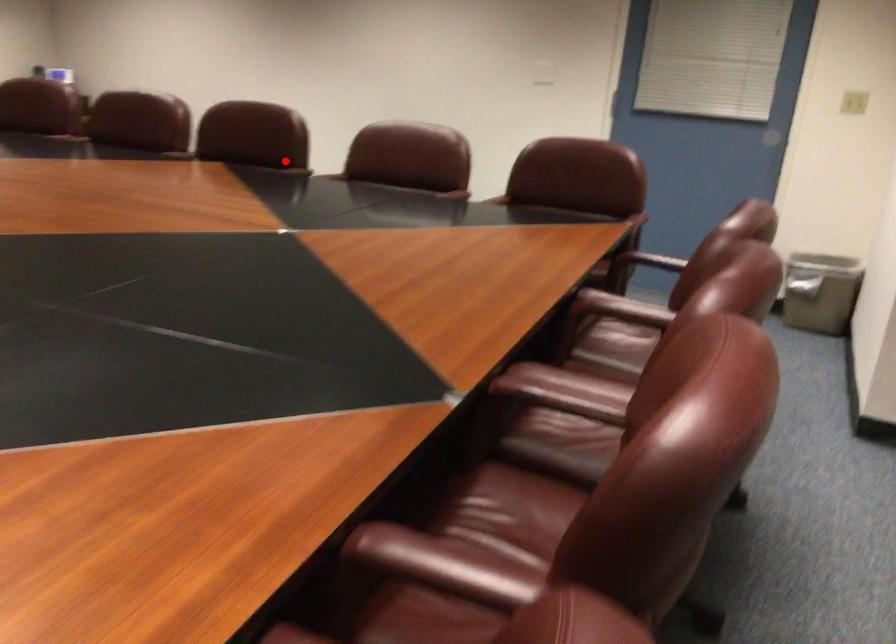
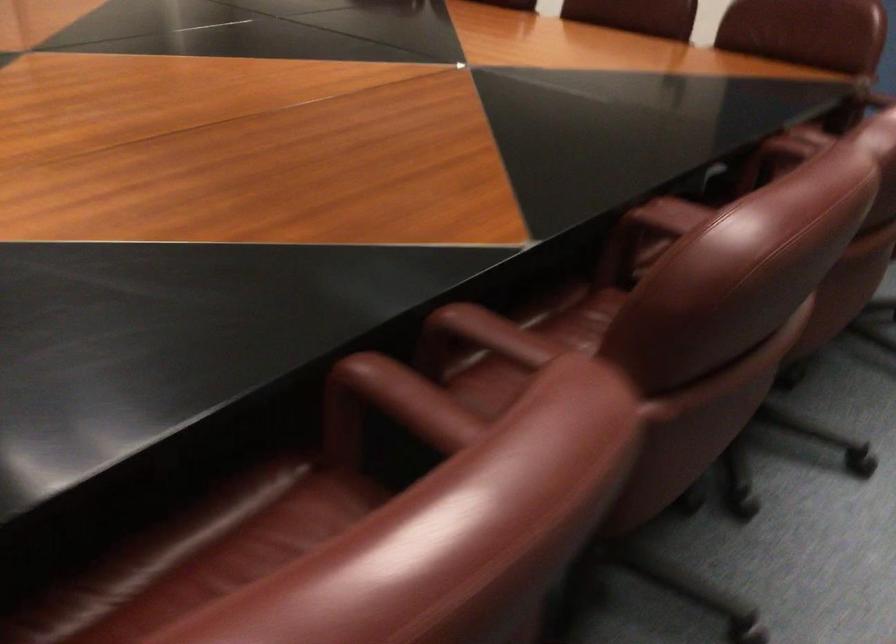
The point at the highlighted location is marked in the first image. Where is the corresponding point in the second image?

(493, 334)